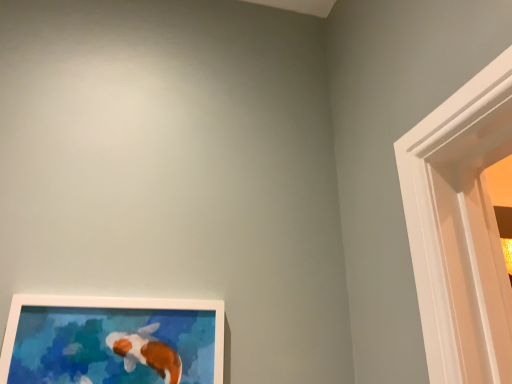
At what (x,y) coordinates should I click in order to perform the action: click on white matte picture frame at lower left. Please return your answer as a coordinate pair (x, y). Image resolution: width=512 pixels, height=384 pixels. Looking at the image, I should click on (112, 341).

What do you see at coordinates (112, 341) in the screenshot? I see `white matte picture frame at lower left` at bounding box center [112, 341].

Identify the location of white matte picture frame at lower left. The image size is (512, 384). (112, 341).